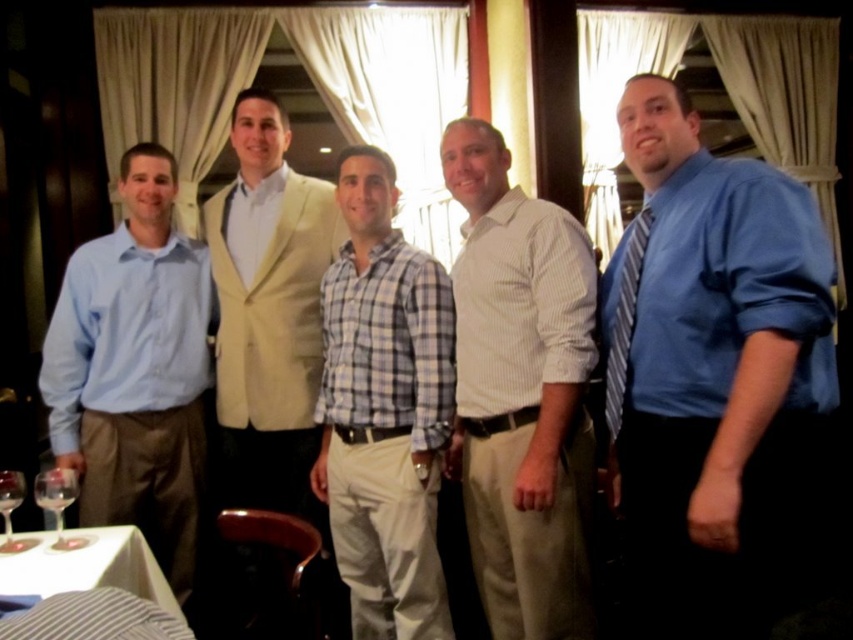
Does blue satin shirt at center appear over light blue checkered shirt at center?

No.

Between blue satin shirt at center and light blue checkered shirt at center, which one appears on the left side from the viewer's perspective?

light blue checkered shirt at center

Locate an element on the screen. The image size is (853, 640). blue satin shirt at center is located at coordinates (712, 374).

Does light blue checkered shirt at center have a greater height compared to transparent glass at lower left?

Yes.

Between point (337, 300) and point (12, 470), which one is positioned in front?

Positioned in front is point (337, 300).

Between point (364, 358) and point (3, 474), which one is positioned in front?

Point (3, 474) is in front.

I want to click on light blue checkered shirt at center, so click(x=384, y=410).

Who is more forward, (270,403) or (608,339)?

Point (608,339) is in front.

Does light beige suit at center have a greater width compared to striped fabric tie at right?

Correct, the width of light beige suit at center exceeds that of striped fabric tie at right.

You are a GUI agent. You are given a task and a screenshot of the screen. Output one action in this format:
    pyautogui.click(x=<x>, y=<y>)
    Task: Click on the light beige suit at center
    
    Given the screenshot: What is the action you would take?
    pyautogui.click(x=270, y=314)